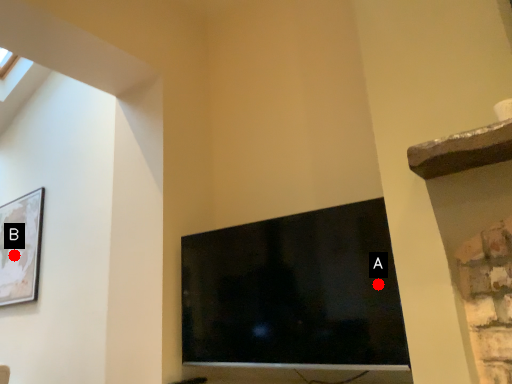
Question: Two points are circled on the image, labeled by A and B beside each circle. Among these points, which one is nearest to the camera?

Choices:
 (A) A is closer
 (B) B is closer

Answer: (A)